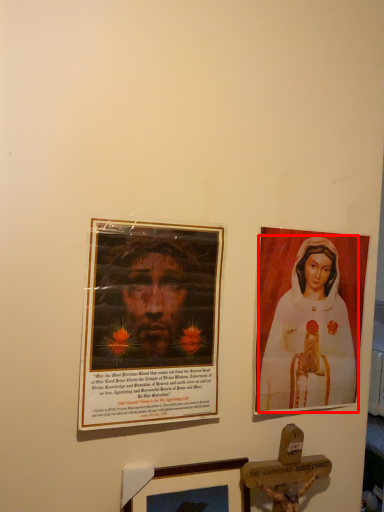
Question: Considering the relative positions of woman (annotated by the red box) and picture frame in the image provided, where is woman (annotated by the red box) located with respect to the staircase?

Choices:
 (A) right
 (B) left

Answer: (A)